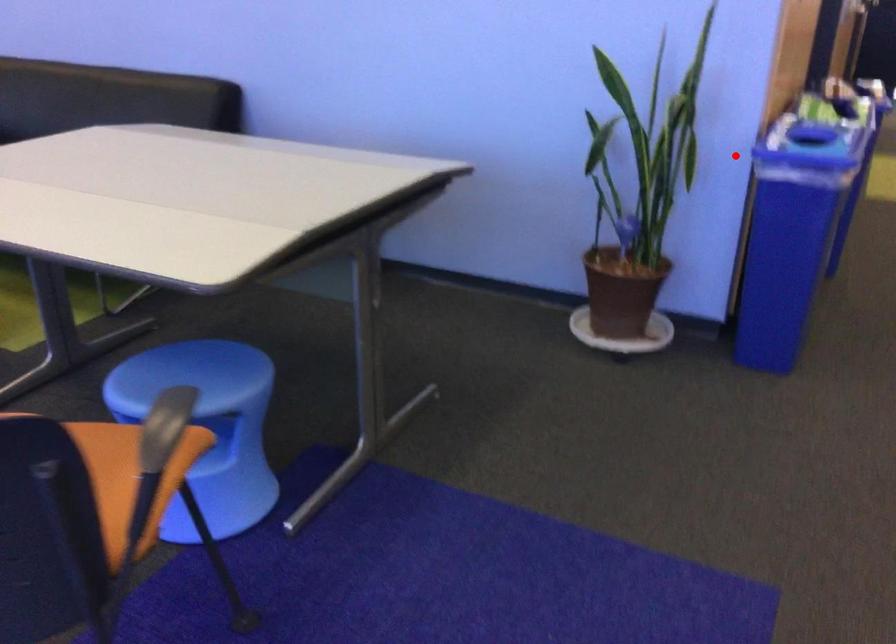
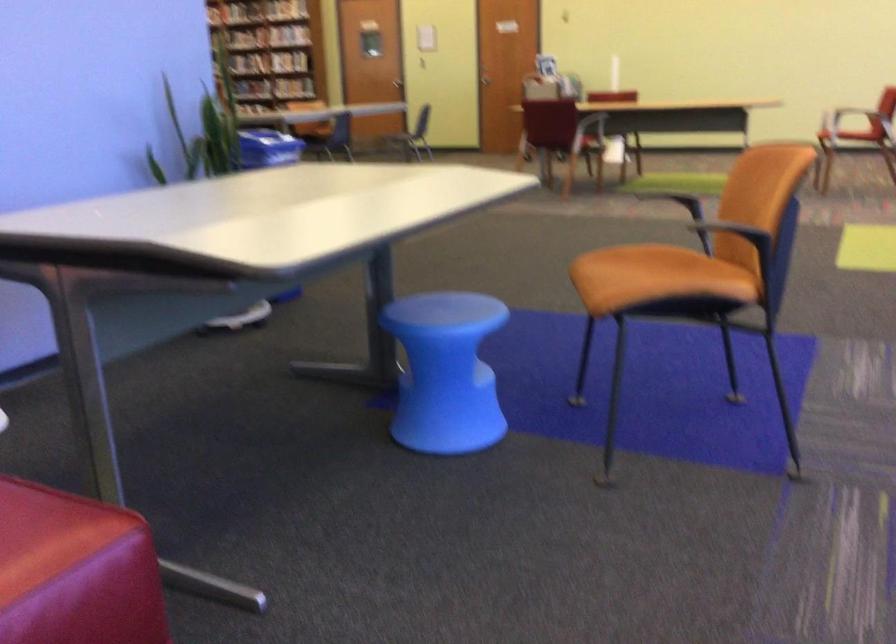
Where in the second image is the point corresponding to the highlighted location from the first image?

(268, 147)